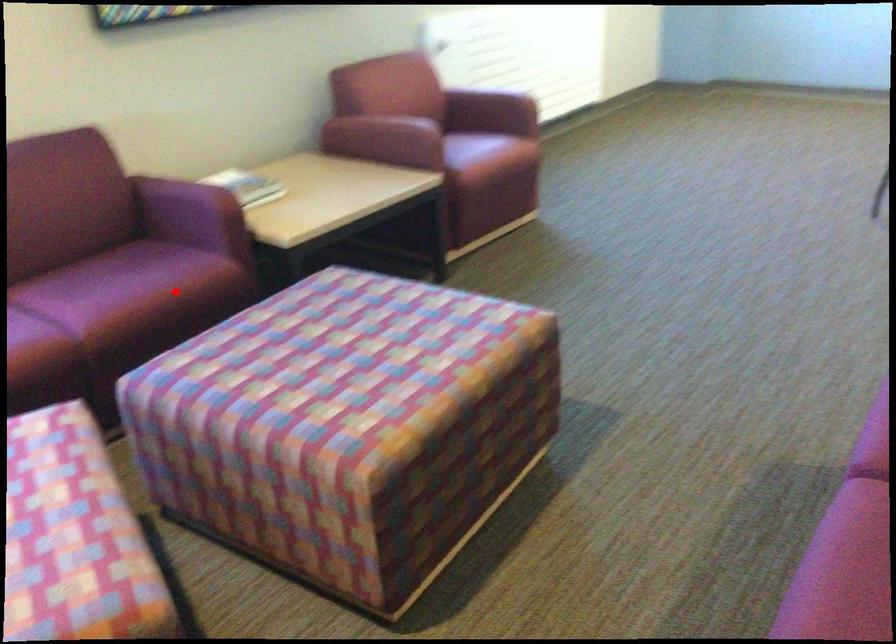
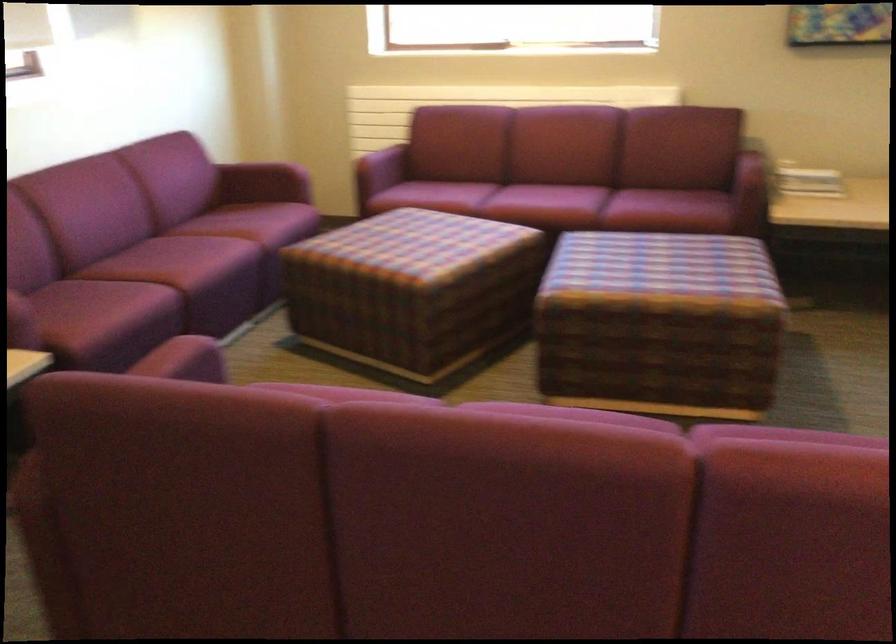
Question: A red point is marked in image1. In image2, is the corresponding 3D point closer to the camera or farther? Reply with the corresponding letter.

Choices:
 (A) The corresponding 3D point is closer.
 (B) The corresponding 3D point is farther.

Answer: (B)